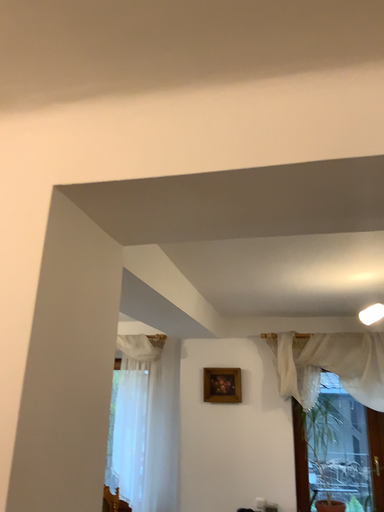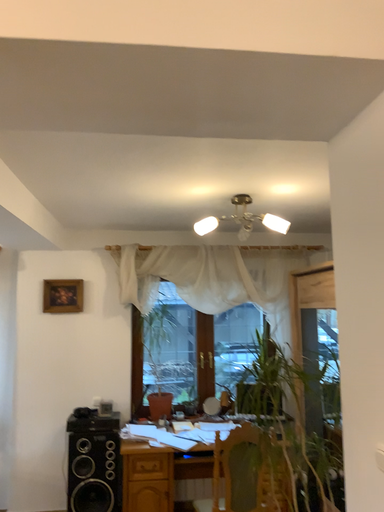
Question: Which way did the camera rotate in the video?

Choices:
 (A) rotated right
 (B) rotated left

Answer: (A)